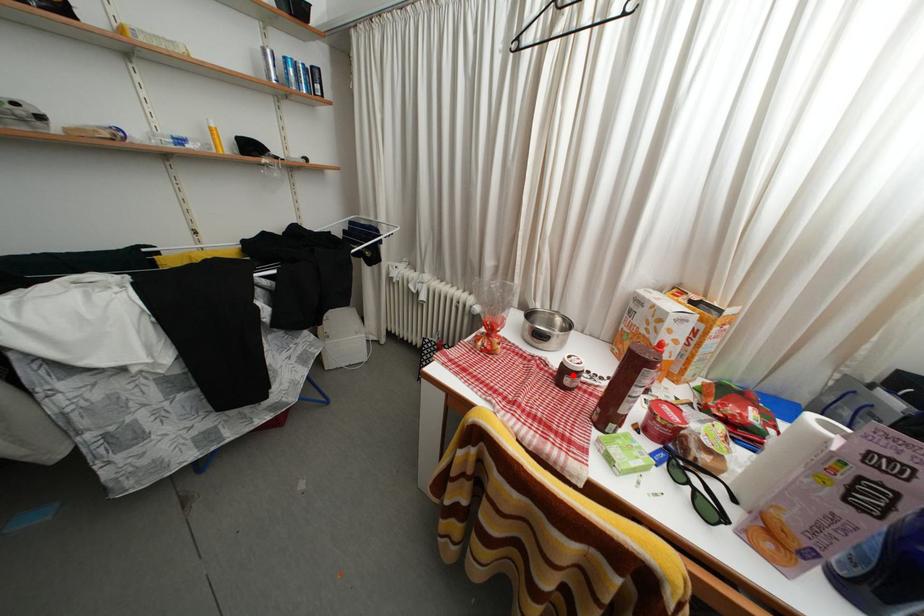
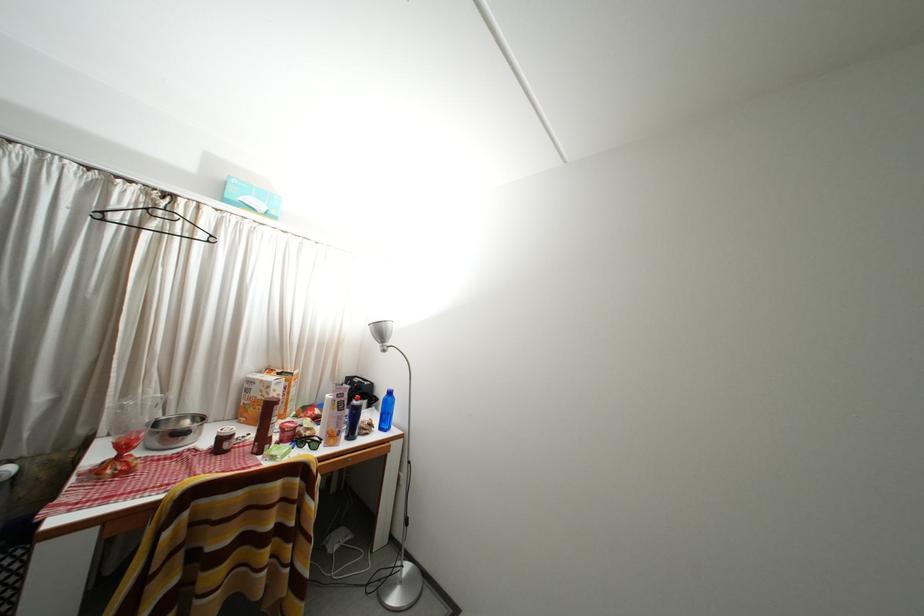
Question: I am providing you with two images of the same scene from different viewpoints. A red point is marked on the first image. Can you still see the location of the red point in image 2?

Choices:
 (A) Yes
 (B) No

Answer: (A)